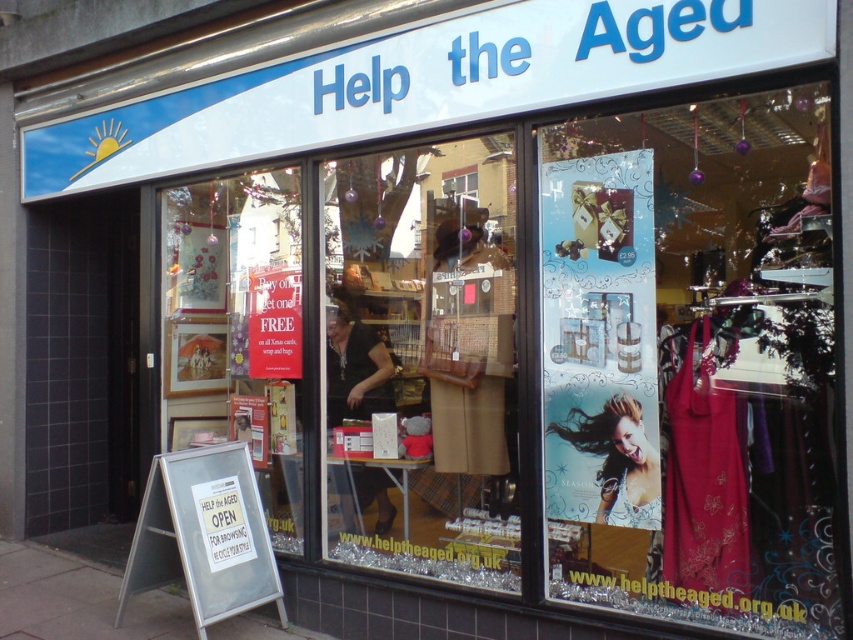
Is matte brown leather handbag at center wider than matte black dress at center?

Yes.

Measure the distance between matte brown leather handbag at center and matte black dress at center.

14.05 inches

Find the location of `matte brown leather handbag at center`. matte brown leather handbag at center is located at coordinates (422, 364).

Does matte brown leather handbag at center have a lesser height compared to shiny silver hair at center?

Incorrect, matte brown leather handbag at center's height does not fall short of shiny silver hair at center's.

Does matte brown leather handbag at center have a lesser width compared to shiny silver hair at center?

Incorrect, matte brown leather handbag at center's width is not less than shiny silver hair at center's.

Between point (361, 444) and point (650, 461), which one is positioned behind?

Point (361, 444)

Locate an element on the screen. This screenshot has width=853, height=640. matte brown leather handbag at center is located at coordinates (422, 364).

Is metallic silver poster at center taller than matte brown leather handbag at center?

In fact, metallic silver poster at center may be shorter than matte brown leather handbag at center.

Is metallic silver poster at center in front of matte brown leather handbag at center?

That is True.

Which is behind, point (596, 131) or point (344, 326)?

Positioned behind is point (344, 326).

Where is `metallic silver poster at center`? metallic silver poster at center is located at coordinates (692, 362).